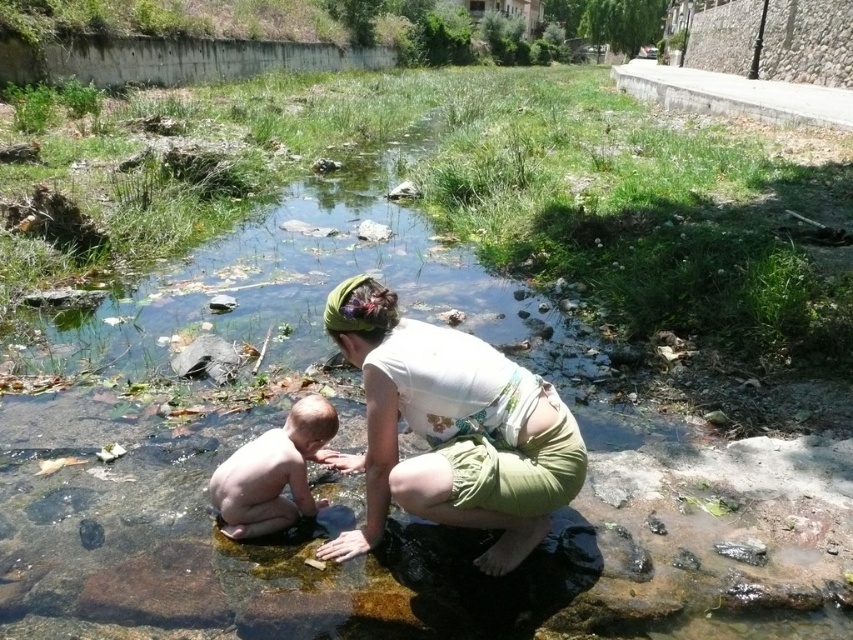
Question: Which of the following is the farthest from the observer?

Choices:
 (A) (527, 449)
 (B) (300, 492)

Answer: (B)

Question: Is white fabric at center closer to the viewer compared to smooth skin baby at center?

Choices:
 (A) yes
 (B) no

Answer: (A)

Question: Is white fabric at center above smooth skin baby at center?

Choices:
 (A) yes
 (B) no

Answer: (A)

Question: Observing the image, what is the correct spatial positioning of white fabric at center in reference to smooth skin baby at center?

Choices:
 (A) below
 (B) above

Answer: (B)

Question: Which point appears farthest from the camera in this image?

Choices:
 (A) pyautogui.click(x=419, y=394)
 (B) pyautogui.click(x=239, y=484)

Answer: (B)

Question: Which point is farther to the camera?

Choices:
 (A) (585, 460)
 (B) (297, 499)

Answer: (B)